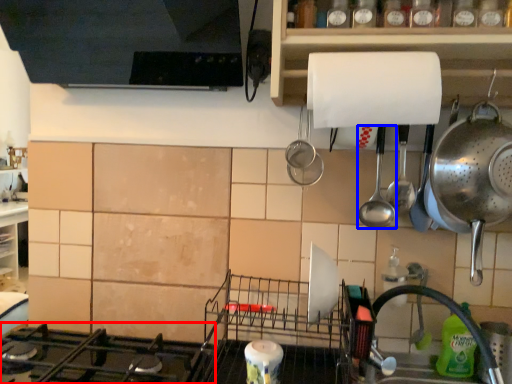
Question: Which object appears closest to the camera in this image, gas stove (highlighted by a red box) or spoon (highlighted by a blue box)?

Choices:
 (A) gas stove
 (B) spoon

Answer: (A)